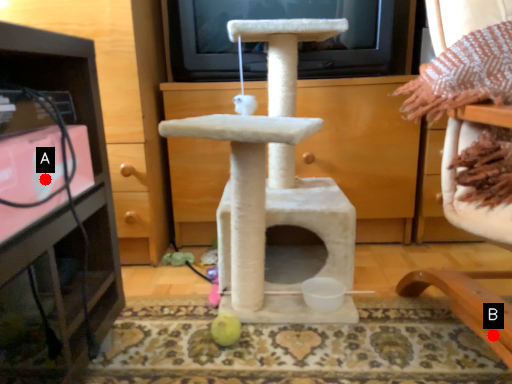
Question: Two points are circled on the image, labeled by A and B beside each circle. Which point is closer to the camera?

Choices:
 (A) A is closer
 (B) B is closer

Answer: (A)